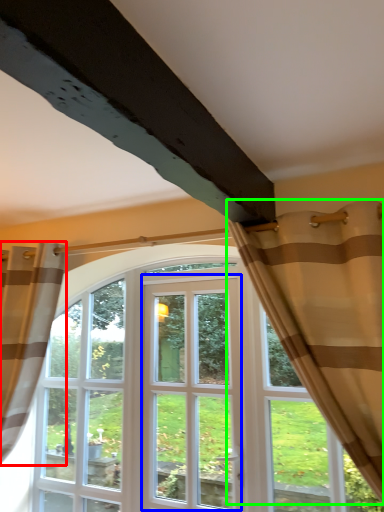
Question: Which is farther away from curtain (highlighted by a red box)? screen door (highlighted by a blue box) or curtain (highlighted by a green box)?

Choices:
 (A) screen door
 (B) curtain

Answer: (B)